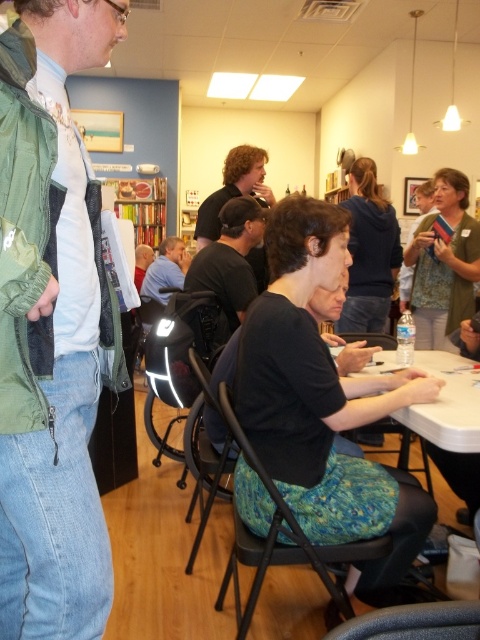
Which of these two, black matte skirt at center or blue fabric shirt at center, stands shorter?

blue fabric shirt at center is shorter.

Measure the distance from black matte skirt at center to blue fabric shirt at center.

black matte skirt at center and blue fabric shirt at center are 3.79 meters apart.

Between point (275, 275) and point (177, 262), which one is positioned behind?

The point (177, 262) is more distant.

Where is `black matte skirt at center`? black matte skirt at center is located at coordinates (322, 400).

Which is in front, point (29, 44) or point (157, 294)?

Point (29, 44) is in front.

Identify the location of green fabric jacket at left. This screenshot has width=480, height=640. (52, 326).

What do you see at coordinates (52, 326) in the screenshot? The height and width of the screenshot is (640, 480). I see `green fabric jacket at left` at bounding box center [52, 326].

At what (x,y) coordinates should I click in order to perform the action: click on green fabric jacket at left. Please return your answer as a coordinate pair (x, y). Image resolution: width=480 pixels, height=640 pixels. Looking at the image, I should click on (52, 326).

Is the position of white plastic table at lower center less distant than that of black shirt at center?

Yes.

Which is more to the right, white plastic table at lower center or black shirt at center?

Positioned to the right is white plastic table at lower center.

Between point (393, 353) and point (237, 256), which one is positioned behind?

Point (237, 256)

Locate an element on the screen. white plastic table at lower center is located at coordinates (446, 403).